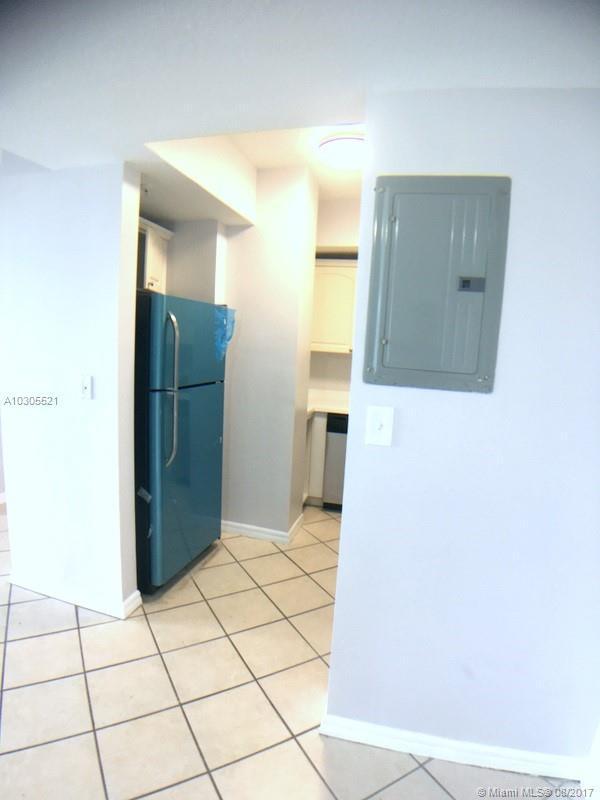
The width and height of the screenshot is (600, 800). Find the location of `tile floor`. tile floor is located at coordinates [x=215, y=662].